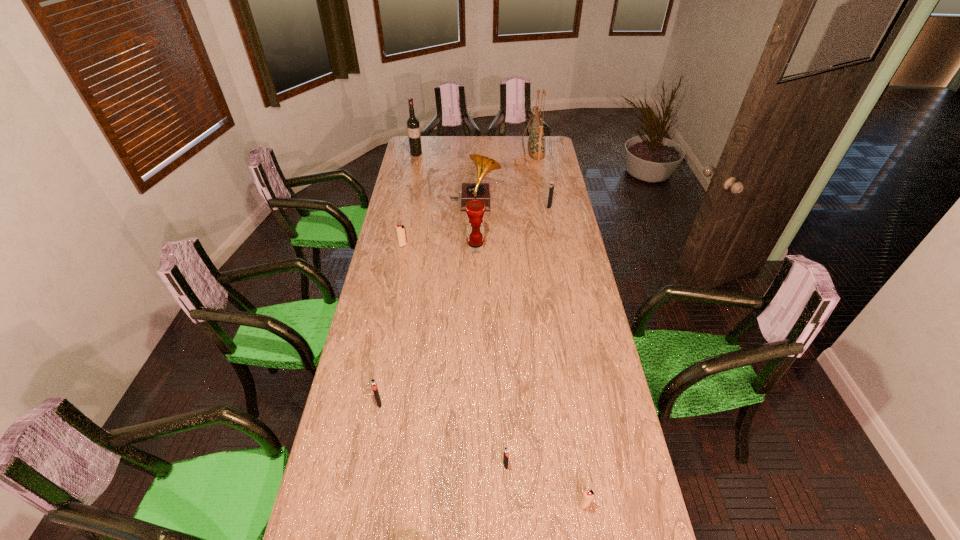
Where is `vacant space that's between the third farthest igniter and the condiment`? This screenshot has width=960, height=540. vacant space that's between the third farthest igniter and the condiment is located at coordinates (427, 326).

This screenshot has width=960, height=540. Find the location of `free space between the leftmost black igniter and the fifth shortest object`. free space between the leftmost black igniter and the fifth shortest object is located at coordinates (465, 305).

Where is `free space between the handbag and the second biggest black igniter`? free space between the handbag and the second biggest black igniter is located at coordinates (454, 276).

Where is `free space that is in between the eighth farthest object and the seventh farthest object`? The height and width of the screenshot is (540, 960). free space that is in between the eighth farthest object and the seventh farthest object is located at coordinates (443, 434).

The height and width of the screenshot is (540, 960). In order to click on vacant area that lies between the farthest black igniter and the second biggest black igniter in this screenshot , I will do `click(465, 305)`.

This screenshot has height=540, width=960. I want to click on object that is the fourth closest to the wine bottle, so click(x=475, y=210).

In order to click on object that is the closest to the second nearest black igniter in this screenshot , I will do `click(506, 453)`.

You are a GUI agent. You are given a task and a screenshot of the screen. Output one action in this format:
    pyautogui.click(x=<x>, y=<y>)
    Task: Click on the third closest igniter relative to the handbag
    The width and height of the screenshot is (960, 540).
    Given the screenshot: What is the action you would take?
    pyautogui.click(x=374, y=386)

Identify which igniter is the fourth nearest to the wine bottle. Please provide its 2D coordinates. Your answer should be formatted as a tuple, i.e. [(x, y)], where the tuple contains the x and y coordinates of a point satisfying the conditions above.

[(506, 453)]

Identify which black igniter is the third nearest to the wine bottle. Please provide its 2D coordinates. Your answer should be formatted as a tuple, i.e. [(x, y)], where the tuple contains the x and y coordinates of a point satisfying the conditions above.

[(506, 453)]